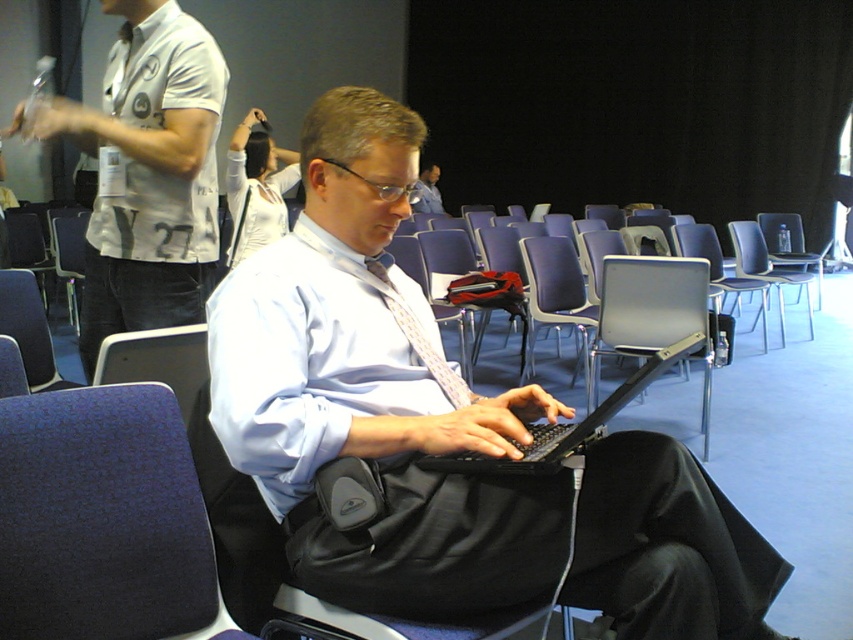
You are organizing a workshop in the conference room and need to ensure that all chairs are of equal height for a proper setup. You have two chairs to check first. The dark blue fabric chair at lower left and the blue plastic chair at center. Which chair should you adjust to match the height of the other?

The dark blue fabric chair at lower left has a lesser height compared to the blue plastic chair at center. Therefore, you should adjust the dark blue fabric chair at lower left to match the height of the blue plastic chair at center.

You are organizing a workshop and need to accommodate two participants. You have a dark blue fabric chair at lower left and a blue plastic chair at center. Which chair can comfortably seat a larger person?

The blue plastic chair at center has a greater width than the dark blue fabric chair at lower left, so it can comfortably seat a larger person.